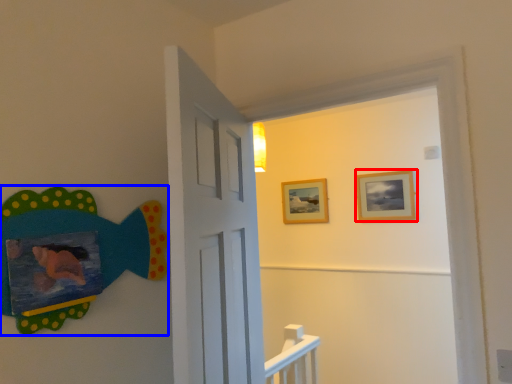
Question: Which object is further to the camera taking this photo, picture frame (highlighted by a red box) or art (highlighted by a blue box)?

Choices:
 (A) picture frame
 (B) art

Answer: (A)